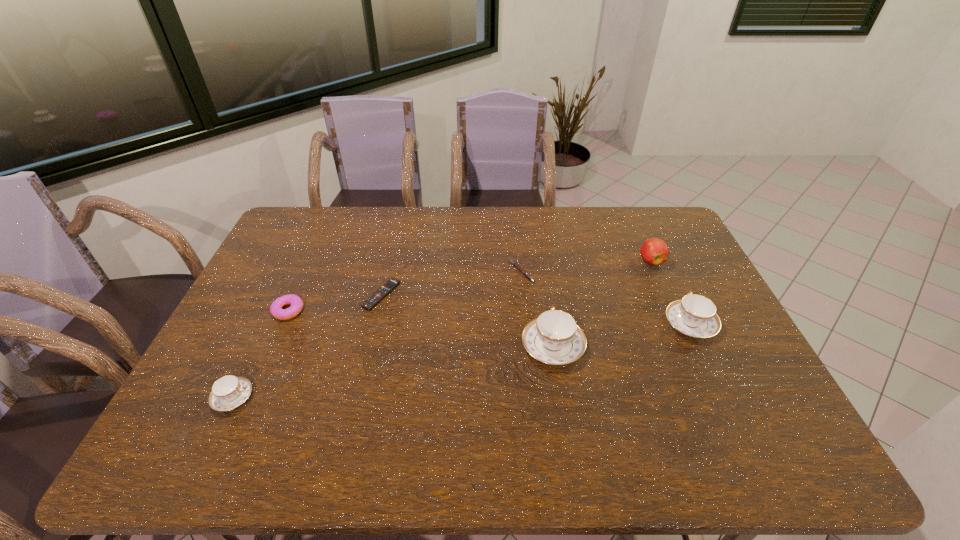
You are a GUI agent. You are given a task and a screenshot of the screen. Output one action in this format:
    pyautogui.click(x=<x>, y=<y>)
    Task: Click on the shortest teacup
    This screenshot has width=960, height=540.
    Given the screenshot: What is the action you would take?
    pyautogui.click(x=228, y=392)

Locate an element on the screen. Image resolution: width=960 pixels, height=540 pixels. the nearest object is located at coordinates (228, 392).

You are a GUI agent. You are given a task and a screenshot of the screen. Output one action in this format:
    pyautogui.click(x=<x>, y=<y>)
    Task: Click on the second teacup from right to left
    
    Given the screenshot: What is the action you would take?
    click(554, 338)

Where is `the second tallest teacup`? the second tallest teacup is located at coordinates (695, 315).

Where is `the second shortest object`? This screenshot has width=960, height=540. the second shortest object is located at coordinates (517, 266).

Locate an element on the screen. the third object from left to right is located at coordinates (374, 299).

Where is `remote control`? This screenshot has width=960, height=540. remote control is located at coordinates (374, 299).

Identify the location of apple. (654, 251).

Locate an element on the screen. This screenshot has width=960, height=540. the fifth tallest object is located at coordinates (276, 310).

Where is `free space located on the side with the handle of the fourth tallest object`? This screenshot has width=960, height=540. free space located on the side with the handle of the fourth tallest object is located at coordinates (353, 397).